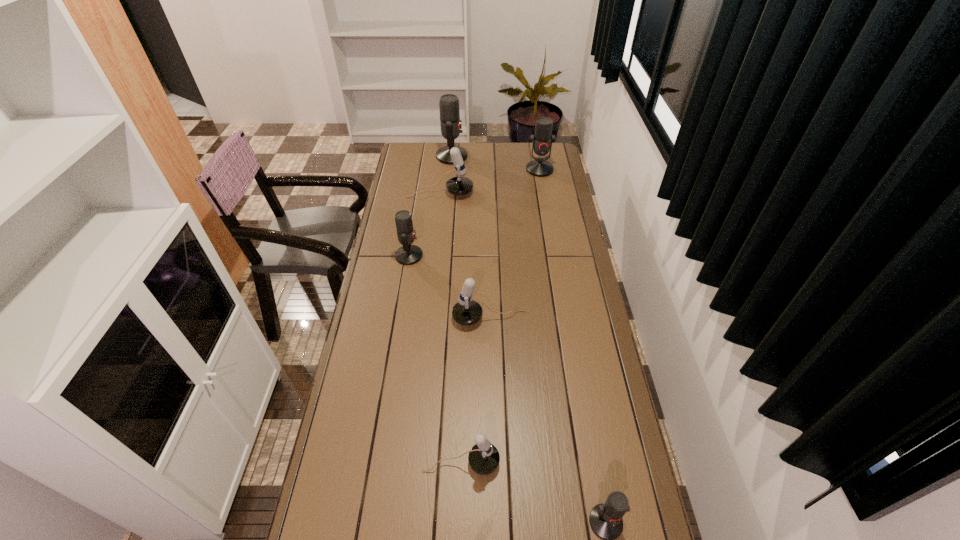
In the image, there is a desktop. At what (x,y) coordinates should I click in order to perform the action: click on vacant space at the left edge. Please return your answer as a coordinate pair (x, y). Looking at the image, I should click on (382, 353).

In the image, there is a desktop. Where is `free space at the right edge`? This screenshot has height=540, width=960. free space at the right edge is located at coordinates (560, 172).

The height and width of the screenshot is (540, 960). In the image, there is a desktop. Find the location of `vacant region at the far left corner`. vacant region at the far left corner is located at coordinates (408, 156).

Find the location of a particular element. This screenshot has width=960, height=540. unoccupied area between the tallest microphone and the fifth farthest object is located at coordinates (470, 237).

Find the location of a particular element. Image resolution: width=960 pixels, height=540 pixels. vacant area that lies between the nearest white microphone and the fifth farthest object is located at coordinates (475, 390).

This screenshot has width=960, height=540. I want to click on free spot between the second nearest white microphone and the second nearest red microphone, so click(x=449, y=287).

What are the coordinates of `object that is the fourth closest one to the biggest red microphone` in the screenshot? It's located at (466, 311).

The image size is (960, 540). In order to click on the second closest object relative to the second nearest red microphone in this screenshot , I will do `click(458, 185)`.

Locate which microphone ranks sixth in proximity to the farthest white microphone. Please provide its 2D coordinates. Your answer should be formatted as a tuple, i.e. [(x, y)], where the tuple contains the x and y coordinates of a point satisfying the conditions above.

[(605, 519)]

Select which microphone is the fifth closest to the nearest object. Please provide its 2D coordinates. Your answer should be formatted as a tuple, i.e. [(x, y)], where the tuple contains the x and y coordinates of a point satisfying the conditions above.

[(542, 140)]